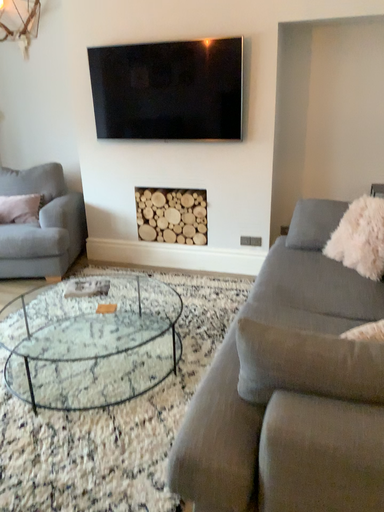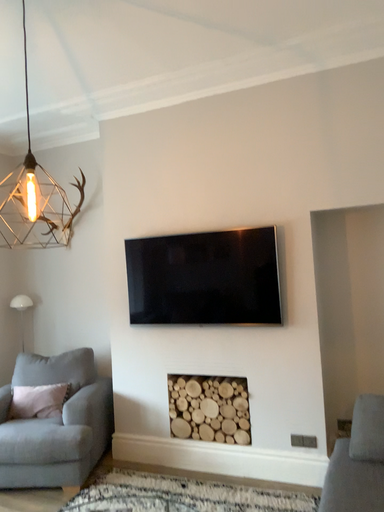
Question: Which way did the camera rotate in the video?

Choices:
 (A) rotated downward
 (B) rotated upward

Answer: (B)